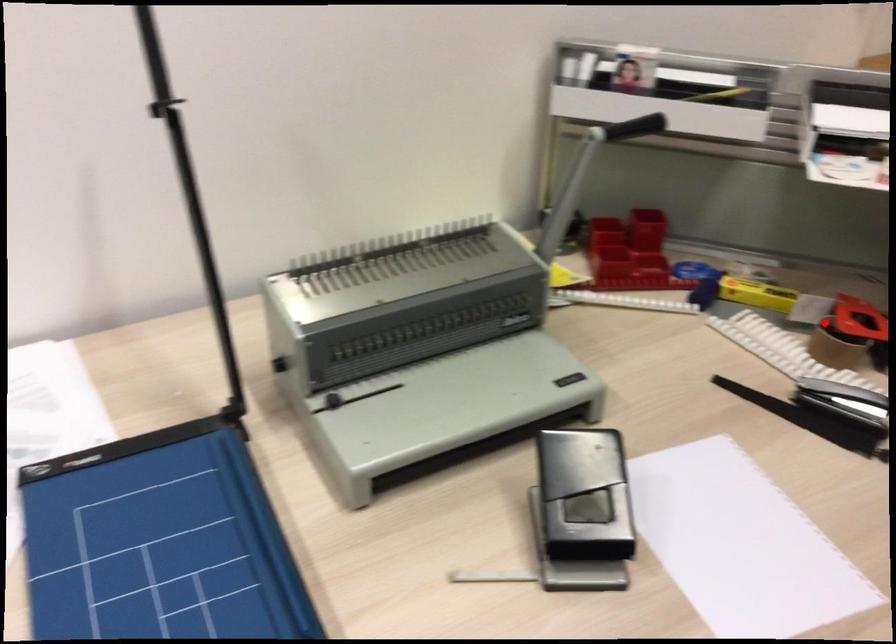
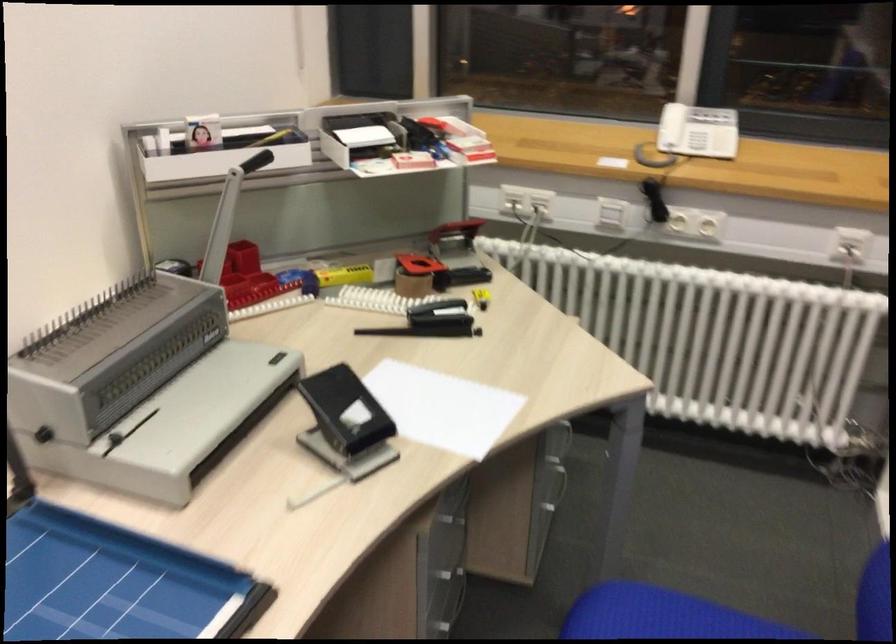
Locate, in the second image, the point that corresponds to the highlighted location in the first image.

(414, 272)